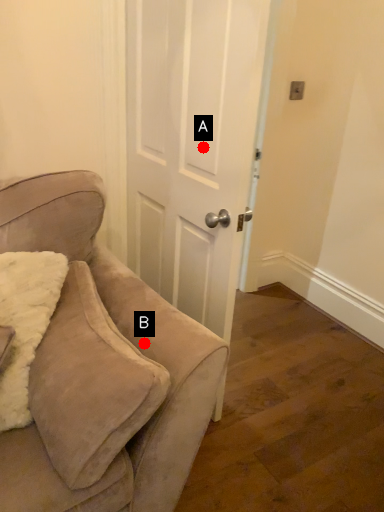
Question: Two points are circled on the image, labeled by A and B beside each circle. Among these points, which one is farthest from the camera?

Choices:
 (A) A is further
 (B) B is further

Answer: (A)